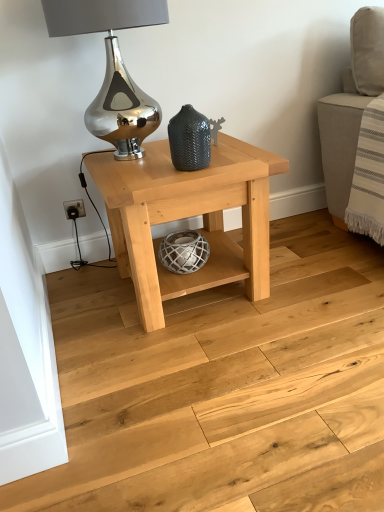
Question: Is natural wood floor at center to the left or to the right of natural wood table at center in the image?

Choices:
 (A) right
 (B) left

Answer: (A)

Question: From the image's perspective, is natural wood floor at center above or below natural wood table at center?

Choices:
 (A) below
 (B) above

Answer: (A)

Question: Based on their relative distances, which object is farther from the shiny metallic table lamp at upper center?

Choices:
 (A) natural wood table at center
 (B) natural wood floor at center
 (C) matte dark gray textured vase at center

Answer: (B)

Question: Which object is positioned closest to the shiny metallic table lamp at upper center?

Choices:
 (A) natural wood floor at center
 (B) matte dark gray textured vase at center
 (C) natural wood table at center

Answer: (B)